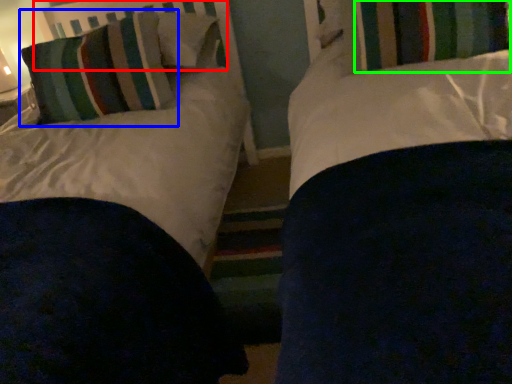
Question: Which object is positioned farthest from headboard (highlighted by a red box)? Select from pillow (highlighted by a blue box) and curtain (highlighted by a green box).

Choices:
 (A) pillow
 (B) curtain

Answer: (B)